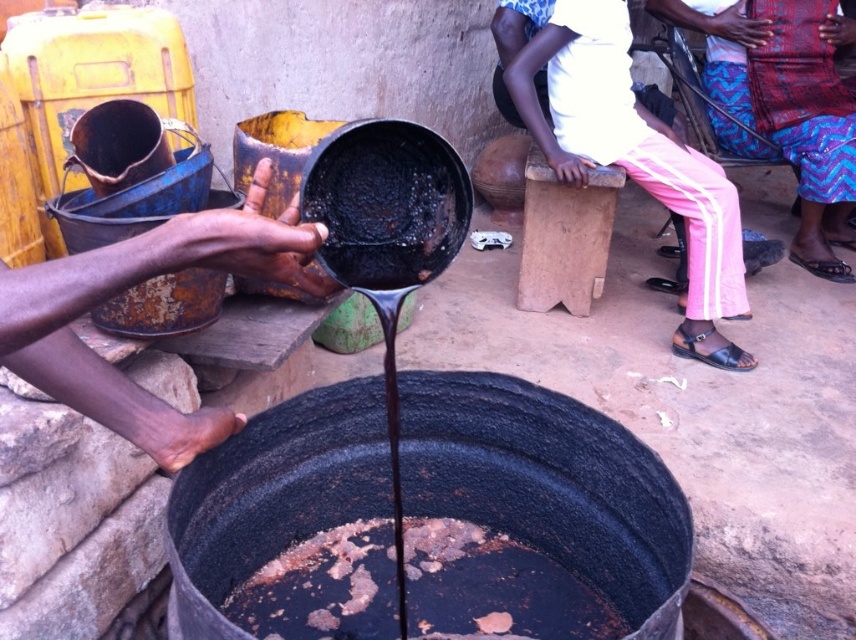
You are standing in the scene and want to pour the liquid from the black matte pot at center into the rusty metal pot at center. Which pot should you hold to pour the liquid into the other?

You should hold the black matte pot at center to pour the liquid into the rusty metal pot at center because the black matte pot at center is closer to you than the rusty metal pot at center.